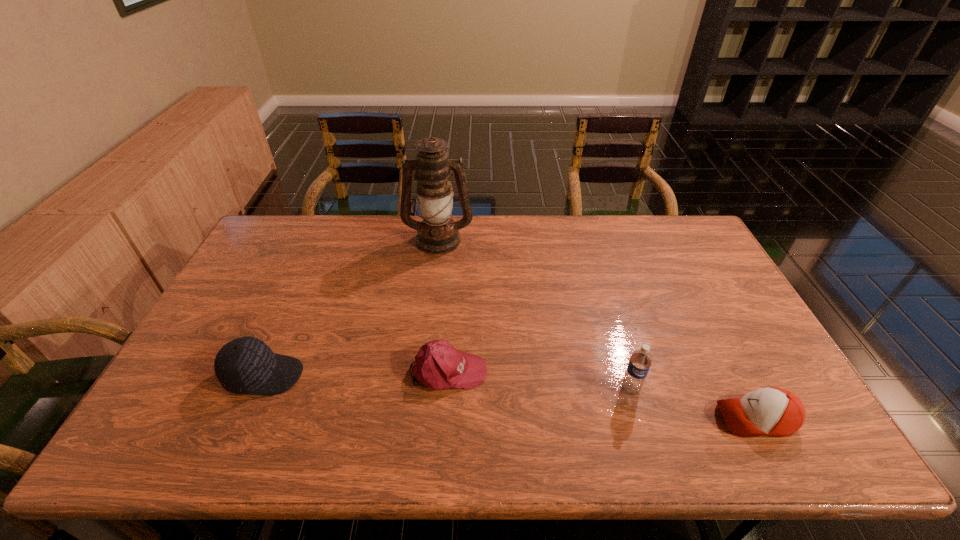
Find the location of a particular element. Image resolution: width=960 pixels, height=540 pixels. object that is at the near right corner is located at coordinates (774, 411).

In the image, there is a desktop. Identify the location of vacant region at the far edge. This screenshot has height=540, width=960. (557, 246).

This screenshot has height=540, width=960. I want to click on free space at the left edge of the desktop, so click(x=172, y=377).

Locate an element on the screen. The image size is (960, 540). free space at the right edge of the desktop is located at coordinates (716, 331).

The height and width of the screenshot is (540, 960). What are the coordinates of `vacant area at the far left corner` in the screenshot? It's located at (273, 249).

Where is `vacant region at the near left corner of the desktop`? The height and width of the screenshot is (540, 960). vacant region at the near left corner of the desktop is located at coordinates (209, 431).

You are a GUI agent. You are given a task and a screenshot of the screen. Output one action in this format:
    pyautogui.click(x=<x>, y=<y>)
    Task: Click on the free spot between the nearest baseball cap and the second baseball cap from right to left
    This screenshot has width=960, height=540.
    Given the screenshot: What is the action you would take?
    pyautogui.click(x=602, y=394)

The height and width of the screenshot is (540, 960). What are the coordinates of `free space between the rightmost object and the tallest object` in the screenshot? It's located at (597, 328).

At what (x,y) coordinates should I click in order to perform the action: click on free area in between the fourth object from left to right and the second baseball cap from right to left. Please return your answer as a coordinate pair (x, y). Looking at the image, I should click on pos(540,380).

Identify the location of free spot between the second tallest object and the nearest object. This screenshot has width=960, height=540. tap(693, 403).